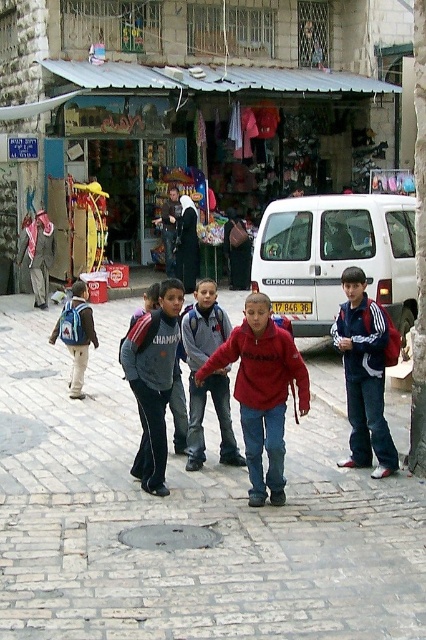
Question: Does red matte sweatshirt at center appear on the left side of gray fleece jacket at center?

Choices:
 (A) no
 (B) yes

Answer: (A)

Question: Considering the real-world distances, which object is farthest from the red matte sweatshirt at center?

Choices:
 (A) blue fabric jacket at center
 (B) red matte jacket at center
 (C) metallic silver awning at center

Answer: (C)

Question: Among these points, which one is farthest from the camera?

Choices:
 (A) (80, 288)
 (B) (201, 458)

Answer: (A)

Question: Is metallic silver awning at center bigger than gray fleece jacket at center?

Choices:
 (A) no
 (B) yes

Answer: (B)

Question: Where is red matte sweatshirt at center located in relation to blue fabric jacket at center in the image?

Choices:
 (A) right
 (B) left

Answer: (B)

Question: Which point is closer to the camera taking this photo?

Choices:
 (A) (77, 333)
 (B) (68, 452)
 (C) (221, 433)
 (D) (227, 176)

Answer: (C)